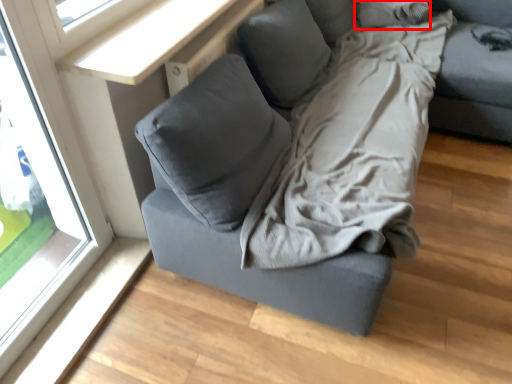
Question: From the image's perspective, where is pillow (annotated by the red box) located in relation to window in the image?

Choices:
 (A) below
 (B) above

Answer: (B)